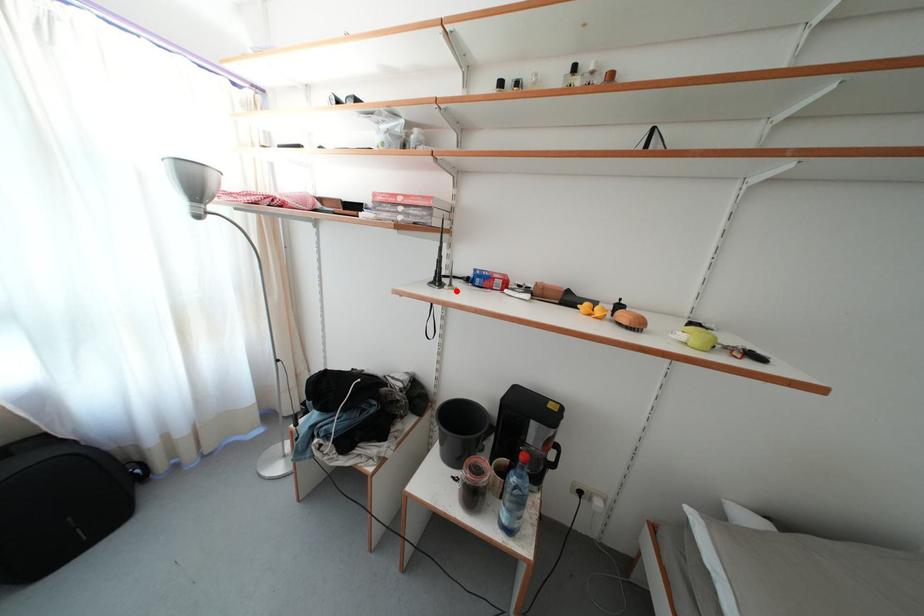
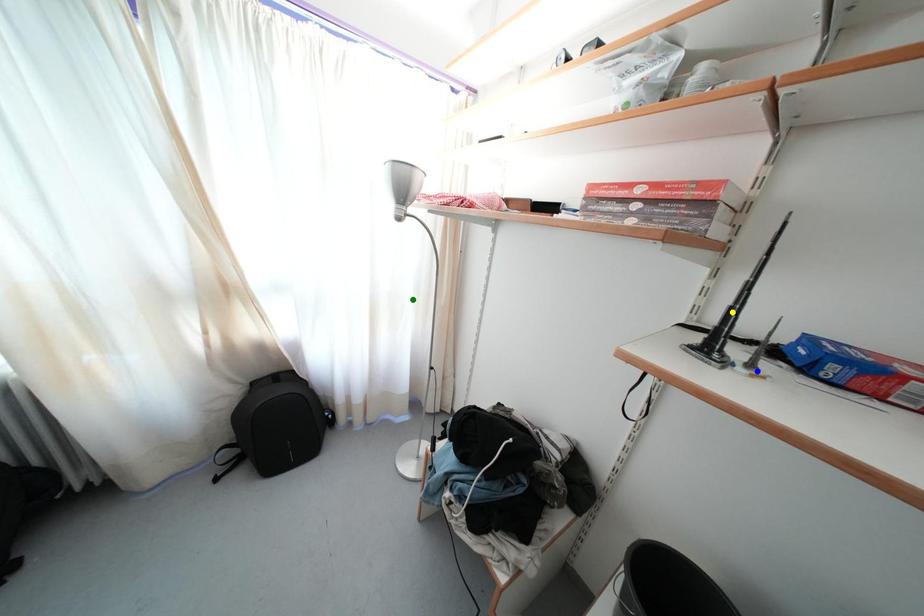
Question: I am providing you with two images of the same scene from different viewpoints. A red point is marked on the first image. You are given multiple points on the second image. Can you choose the point in image 2 that corresponds to the point in image 1?

Choices:
 (A) green point
 (B) yellow point
 (C) blue point

Answer: (C)